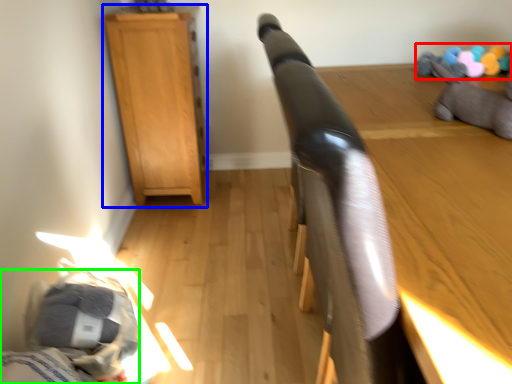
Question: Considering the real-world distances, which object is farthest from toy (highlighted by a red box)? furniture (highlighted by a blue box) or bed (highlighted by a green box)?

Choices:
 (A) furniture
 (B) bed

Answer: (B)